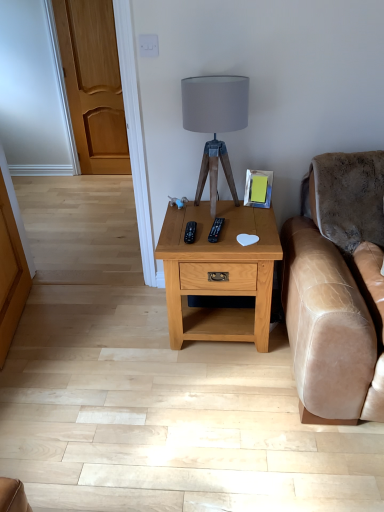
I want to click on free space in front of matte gray fabric lampshade at center, so click(220, 228).